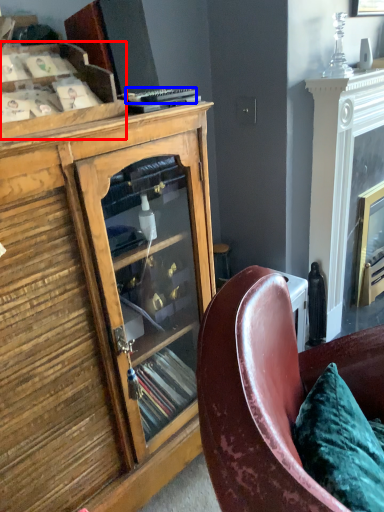
Question: Which of the following is the closest to the observer, shelf (highlighted by a red box) or remote control (highlighted by a blue box)?

Choices:
 (A) shelf
 (B) remote control

Answer: (A)